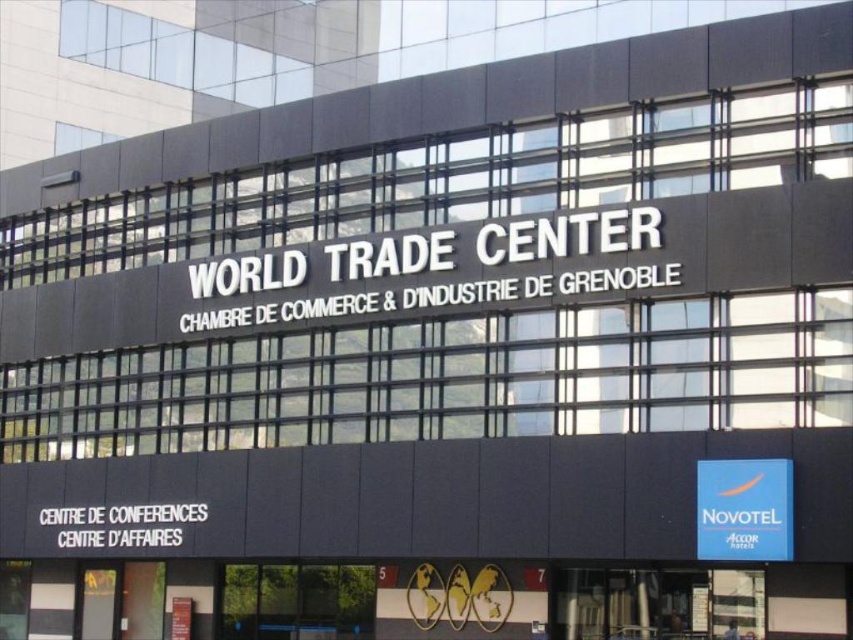
You are a delivery person who needs to hand over a package to the reception at the World Trade Center. You see the white metallic sign at center and the blue fabric sign at center. Which sign should you approach first if you want to reach the reception quickly?

The white metallic sign at center is the main sign of the building, so you should approach the white metallic sign at center first to reach the reception quickly.

You are a delivery person trying to park your van in front of the World Trade Center. The van requires a parking spot that is at least as wide as the white metallic sign at center. Can the blue fabric sign at center help determine if the parking spot is wide enough?

The white metallic sign at center is wider than the blue fabric sign at center. Since the van needs a parking spot at least as wide as the white metallic sign at center, the blue fabric sign at center cannot confirm if the parking spot is wide enough because it is narrower than the required width.

You are standing in front of the World Trade Center and Chambre de Commerce building. You need to locate the white metallic sign at center. Where is it positioned relative to the building?

The white metallic sign at center is positioned at point 0.441 on the horizontal axis and 0.404 on the vertical axis relative to the building.